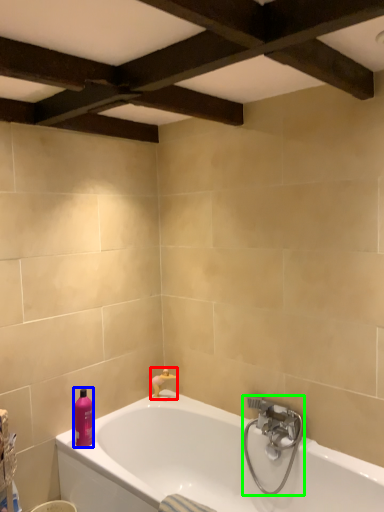
Question: Estimate the real-world distances between objects in this image. Which object is closer to faucet (highlighted by a red box), toiletry (highlighted by a blue box) or tap (highlighted by a green box)?

Choices:
 (A) toiletry
 (B) tap

Answer: (A)